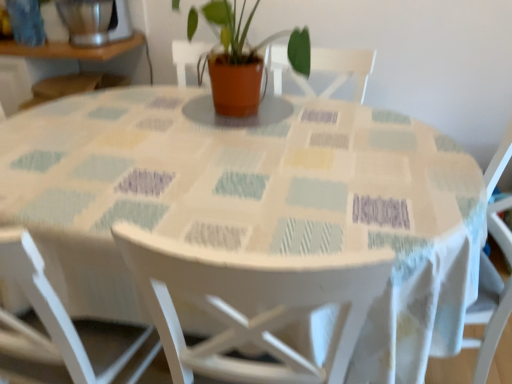
Question: Is white wood chair at center, the 1th chair when ordered from right to left, in front of or behind brushed metal blender at upper left in the image?

Choices:
 (A) front
 (B) behind

Answer: (A)

Question: From a real-world perspective, is white wood chair at center, which ranks as the second chair in left-to-right order, positioned above or below brushed metal blender at upper left?

Choices:
 (A) above
 (B) below

Answer: (B)

Question: Estimate the real-world distances between objects in this image. Which object is closer to the brushed metal blender at upper left?

Choices:
 (A) matte terracotta pot at center
 (B) white wood chair at center, the 1th chair when ordered from right to left
 (C) white wood chair at lower left, the 2th chair from the right

Answer: (A)

Question: Which object is the farthest from the matte terracotta pot at center?

Choices:
 (A) white wood chair at center, the 1th chair when ordered from right to left
 (B) white wood chair at lower left, the 2th chair from the right
 (C) brushed metal blender at upper left

Answer: (B)